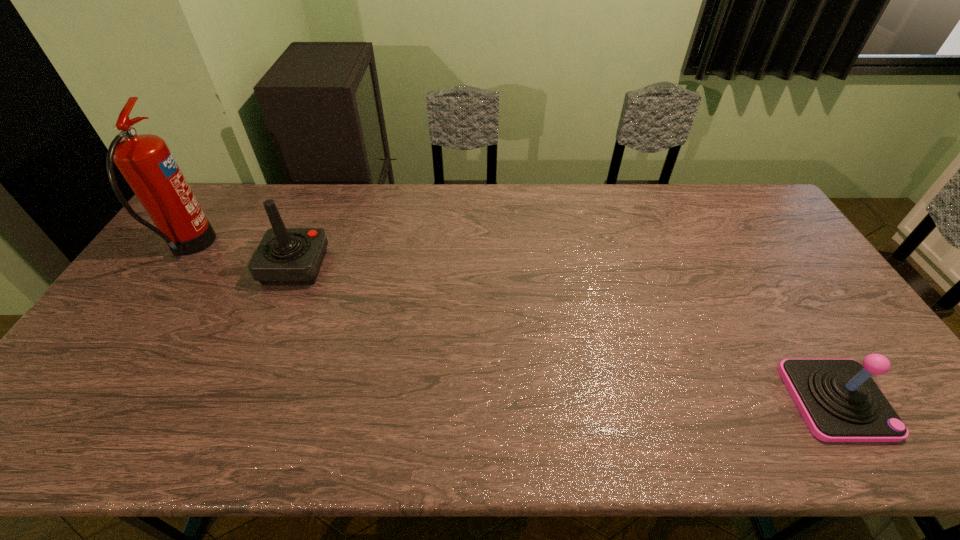
Identify the location of fire extinguisher. Image resolution: width=960 pixels, height=540 pixels. (145, 161).

The height and width of the screenshot is (540, 960). In order to click on the tallest object in this screenshot , I will do `click(145, 161)`.

This screenshot has width=960, height=540. In order to click on the farther joystick in this screenshot , I will do `click(285, 256)`.

This screenshot has height=540, width=960. What are the coordinates of `the second object from left to right` in the screenshot? It's located at (285, 256).

Locate an element on the screen. The width and height of the screenshot is (960, 540). the nearer joystick is located at coordinates (839, 401).

At what (x,y) coordinates should I click in order to perform the action: click on the right joystick. Please return your answer as a coordinate pair (x, y). The height and width of the screenshot is (540, 960). Looking at the image, I should click on (839, 401).

In order to click on vacant position located on the surface of the fire extinguisher in this screenshot , I will do `click(335, 248)`.

Identify the location of free space located 0.390m on the front-facing side of the farther joystick. (451, 266).

Locate an element on the screen. This screenshot has width=960, height=540. object that is at the far edge is located at coordinates (145, 161).

In order to click on object present at the near edge in this screenshot , I will do `click(839, 401)`.